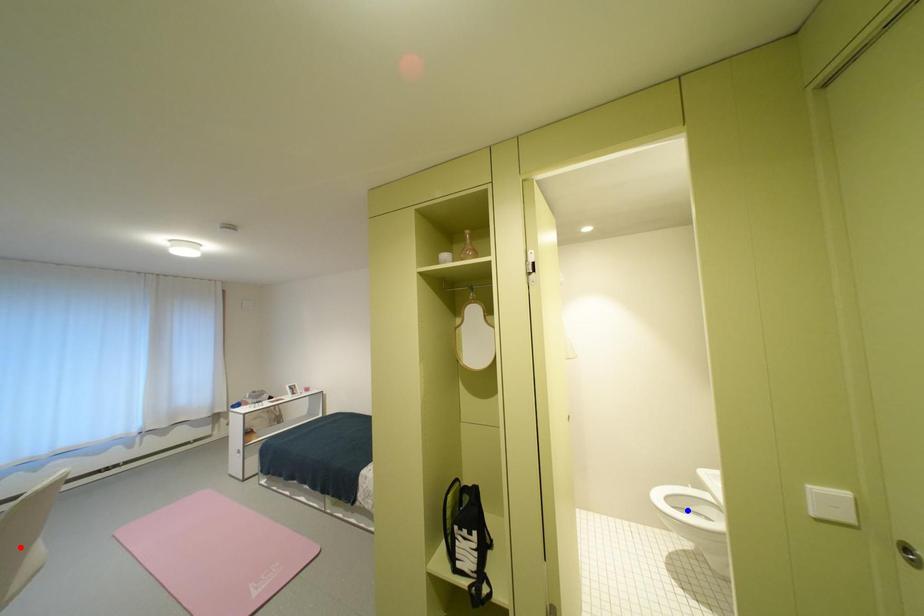
Question: In the image, two points are highlighted. Which point is nearer to the camera? Reply with the corresponding letter.

Choices:
 (A) blue point
 (B) red point

Answer: (B)